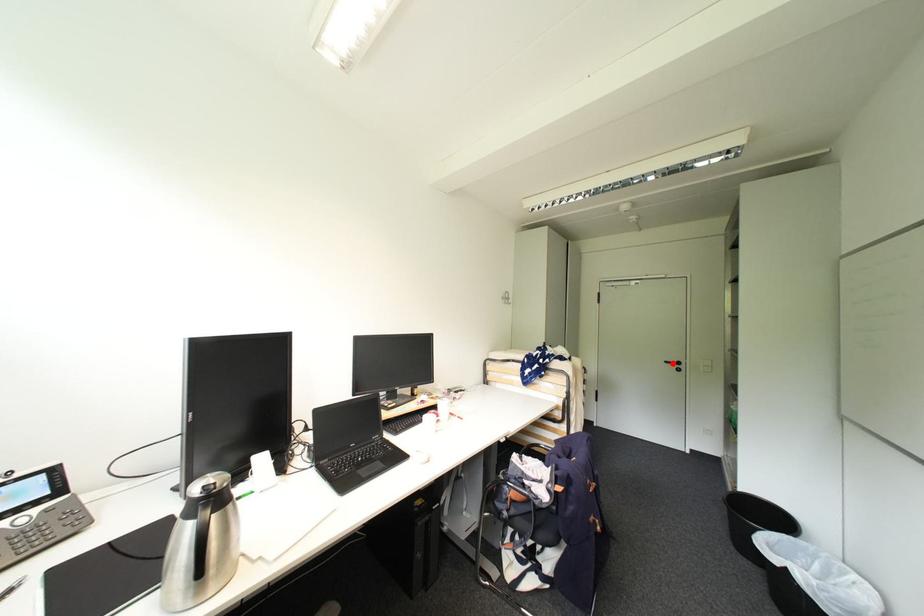
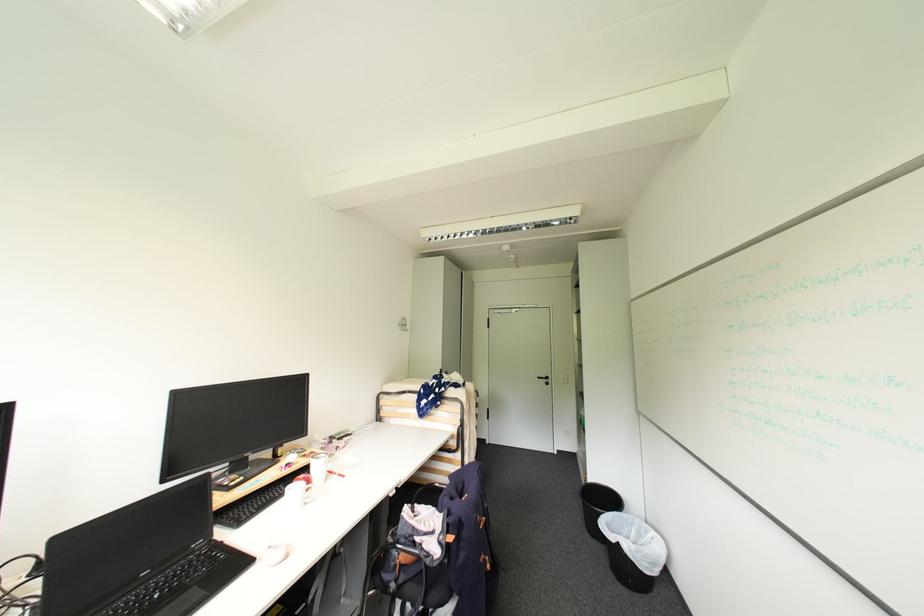
Locate, in the second image, the point that corresponds to the highlighted location in the first image.

(544, 379)